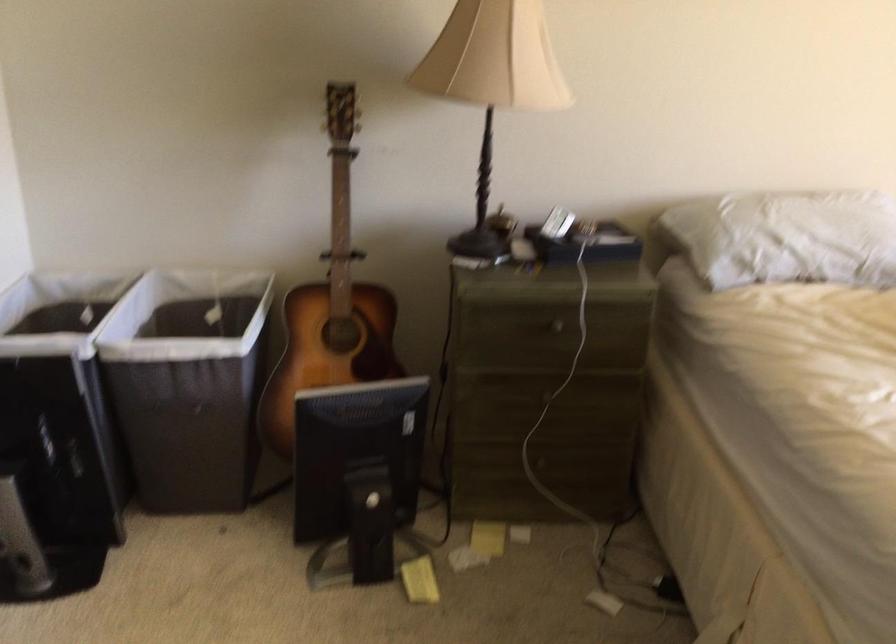
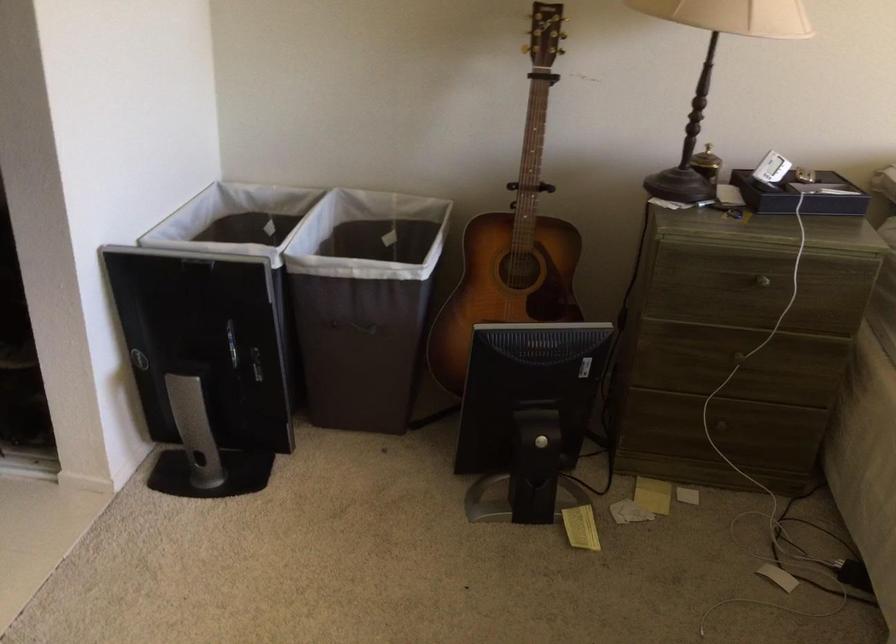
Locate, in the second image, the point that corresponds to the point at 583,247 in the first image.

(800, 194)